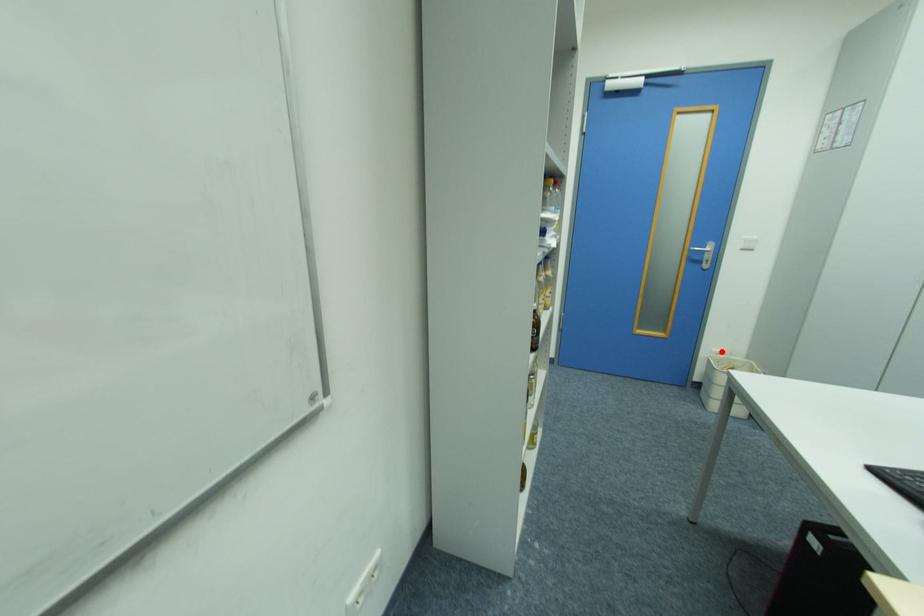
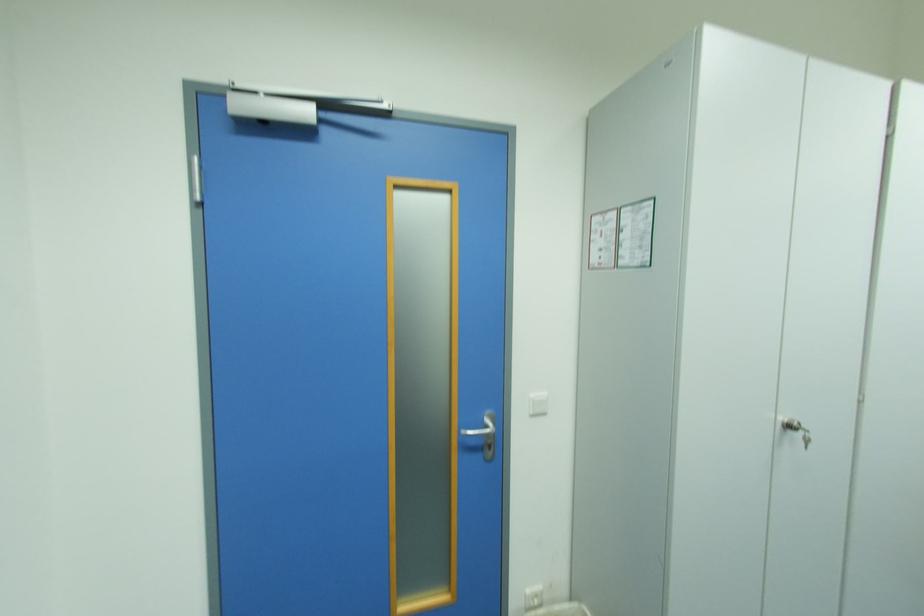
Find the pixel in the second image that matches the highlighted location in the first image.

(535, 592)